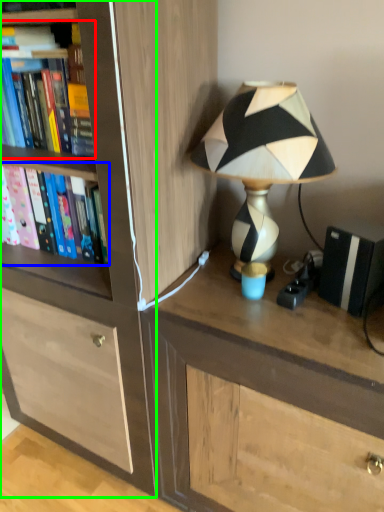
Question: Considering the real-world distances, which object is farthest from book (highlighted by a red box)? book (highlighted by a blue box) or cabinetry (highlighted by a green box)?

Choices:
 (A) book
 (B) cabinetry

Answer: (B)